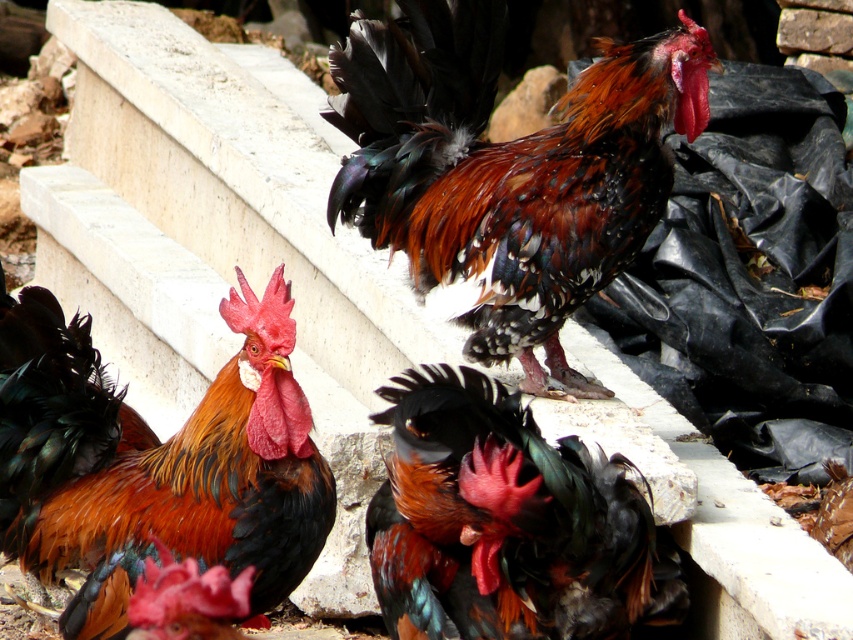
Question: Which object is farther from the camera taking this photo?

Choices:
 (A) shiny orange feathers at center
 (B) shiny black feathers at center
 (C) shiny multicolored rooster at center

Answer: (C)

Question: Can you confirm if shiny multicolored rooster at center is bigger than shiny orange feathers at center?

Choices:
 (A) no
 (B) yes

Answer: (B)

Question: Estimate the real-world distances between objects in this image. Which object is closer to the shiny orange feathers at center?

Choices:
 (A) shiny black feathers at center
 (B) shiny multicolored rooster at center

Answer: (A)

Question: Which is farther from the shiny black feathers at center?

Choices:
 (A) shiny orange feathers at center
 (B) shiny multicolored rooster at center

Answer: (B)

Question: Is shiny orange feathers at center wider than shiny black feathers at center?

Choices:
 (A) no
 (B) yes

Answer: (B)

Question: Is shiny orange feathers at center thinner than shiny black feathers at center?

Choices:
 (A) no
 (B) yes

Answer: (A)